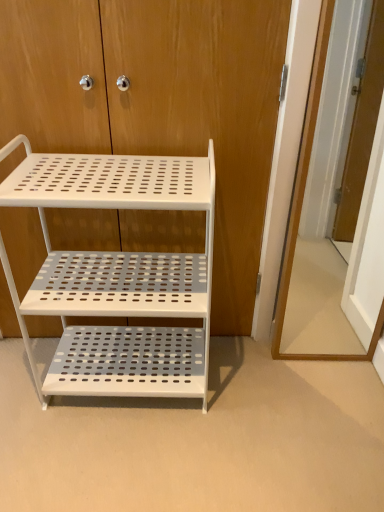
Locate an element on the screen. The width and height of the screenshot is (384, 512). empty space that is to the right of white perforated metal shelf at center is located at coordinates (254, 407).